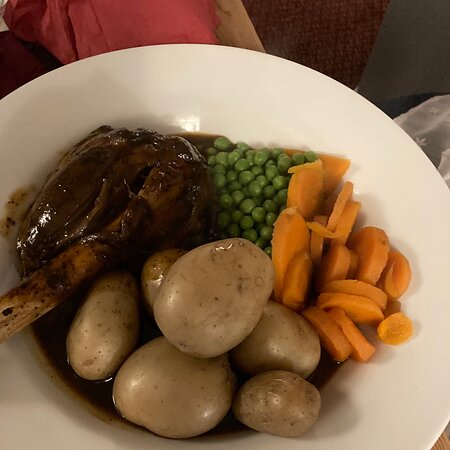
The width and height of the screenshot is (450, 450). I want to click on plate, so click(x=331, y=105).